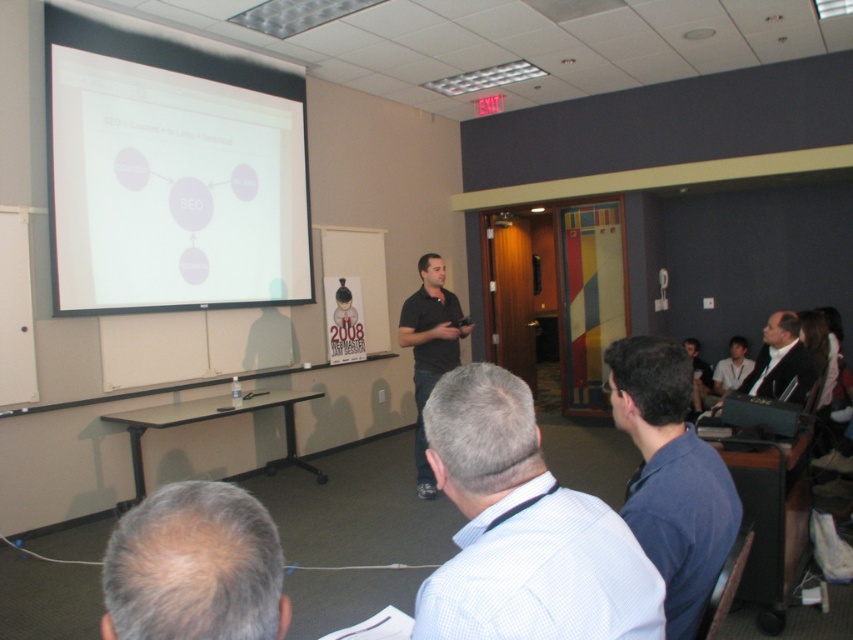
In the scene shown: Where is the white checkered shirt at center located in the image?

The white checkered shirt at center is located at point coordinates of [523,531].

You are a photographer standing in the back of the room. You want to take a photo of the presenter so that both the white checkered shirt at center and the gray hair at center are clearly visible. Based on their distance, will you need to adjust your camera settings to ensure both are in focus?

The white checkered shirt at center and gray hair at center are 13.86 inches apart. Since they are close to each other, you can keep both in focus by using a smaller aperture setting on your camera.

You are standing in the conference room and see the point at coordinates (671, 476). Which object is this point located on?

The point at coordinates (671, 476) is located on the blue shirt at lower right.